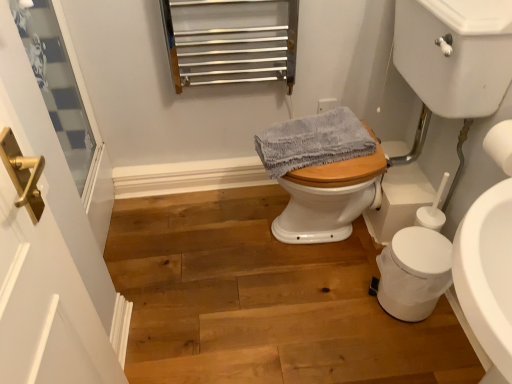
Locate an element on the screen. This screenshot has width=512, height=384. vacant space situated above white matte trash can at lower right (from a real-world perspective) is located at coordinates (424, 248).